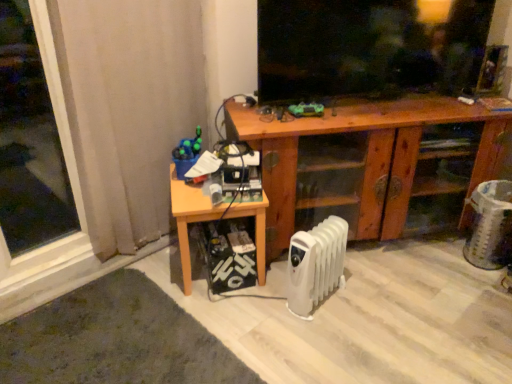
Question: From their relative heights in the image, would you say white plastic radiator at lower center is taller or shorter than transparent glass window at left?

Choices:
 (A) short
 (B) tall

Answer: (A)

Question: Relative to transparent glass window at left, is white plastic radiator at lower center in front or behind?

Choices:
 (A) behind
 (B) front

Answer: (A)

Question: Which object is positioned farthest from the wooden cabinet at center?

Choices:
 (A) white plastic radiator at lower center
 (B) black matte screen at upper center
 (C) transparent glass window at left
 (D) beige fabric curtain at left
 (E) wooden table at lower left

Answer: (C)

Question: Based on their relative distances, which object is nearer to the black matte screen at upper center?

Choices:
 (A) beige fabric curtain at left
 (B) transparent glass window at left
 (C) wooden table at lower left
 (D) white plastic radiator at lower center
 (E) wooden cabinet at center

Answer: (E)